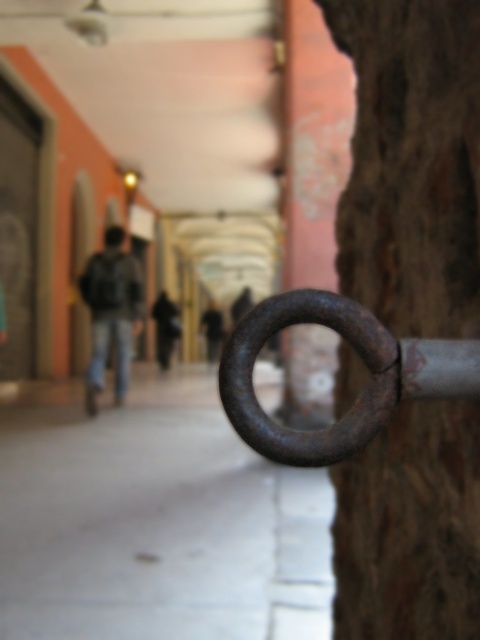
Question: Can you confirm if smooth concrete pavement at center is wider than dark brown leather jacket at center?

Choices:
 (A) yes
 (B) no

Answer: (A)

Question: Based on their relative distances, which object is nearer to the rusty metal ring at center?

Choices:
 (A) smooth concrete pavement at center
 (B) dark gray hoodie at center

Answer: (A)

Question: Observing the image, what is the correct spatial positioning of rusty metal ring at center in reference to dark gray hoodie at center?

Choices:
 (A) above
 (B) below

Answer: (A)

Question: Which point is closer to the camera?

Choices:
 (A) pos(153,314)
 (B) pos(97,369)

Answer: (B)

Question: Considering the real-world distances, which object is closest to the dark gray backpack at center?

Choices:
 (A) rusty metal ring at right
 (B) dark gray hoodie at center
 (C) smooth concrete pavement at center

Answer: (B)

Question: Does dark gray backpack at center have a smaller size compared to dark brown leather jacket at center?

Choices:
 (A) yes
 (B) no

Answer: (B)